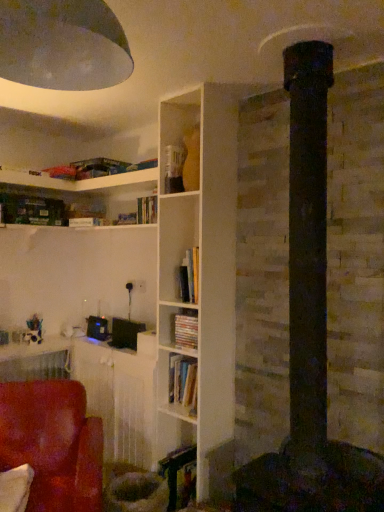
Question: Can you confirm if suede-like red chair at lower left is shorter than matte cardboard book at center?

Choices:
 (A) no
 (B) yes

Answer: (A)

Question: Can you confirm if suede-like red chair at lower left is taller than matte cardboard book at center?

Choices:
 (A) no
 (B) yes

Answer: (B)

Question: Does suede-like red chair at lower left have a greater width compared to matte cardboard book at center?

Choices:
 (A) yes
 (B) no

Answer: (A)

Question: Are suede-like red chair at lower left and matte cardboard book at center making contact?

Choices:
 (A) no
 (B) yes

Answer: (A)

Question: From the image's perspective, is suede-like red chair at lower left located beneath matte cardboard book at center?

Choices:
 (A) yes
 (B) no

Answer: (A)

Question: Is suede-like red chair at lower left behind matte cardboard book at center?

Choices:
 (A) no
 (B) yes

Answer: (A)

Question: Does matte cardboard book at center have a smaller size compared to metallic dome at upper left?

Choices:
 (A) yes
 (B) no

Answer: (A)

Question: Is matte cardboard book at center positioned far away from metallic dome at upper left?

Choices:
 (A) yes
 (B) no

Answer: (A)

Question: Is matte cardboard book at center oriented towards metallic dome at upper left?

Choices:
 (A) no
 (B) yes

Answer: (A)

Question: Considering the relative sizes of matte cardboard book at center and metallic dome at upper left in the image provided, is matte cardboard book at center shorter than metallic dome at upper left?

Choices:
 (A) no
 (B) yes

Answer: (B)

Question: Is matte cardboard book at center surrounding metallic dome at upper left?

Choices:
 (A) no
 (B) yes

Answer: (A)

Question: Is matte cardboard book at center wider than metallic dome at upper left?

Choices:
 (A) no
 (B) yes

Answer: (A)

Question: From a real-world perspective, is metallic dome at upper left positioned over matte cardboard book at center based on gravity?

Choices:
 (A) no
 (B) yes

Answer: (B)